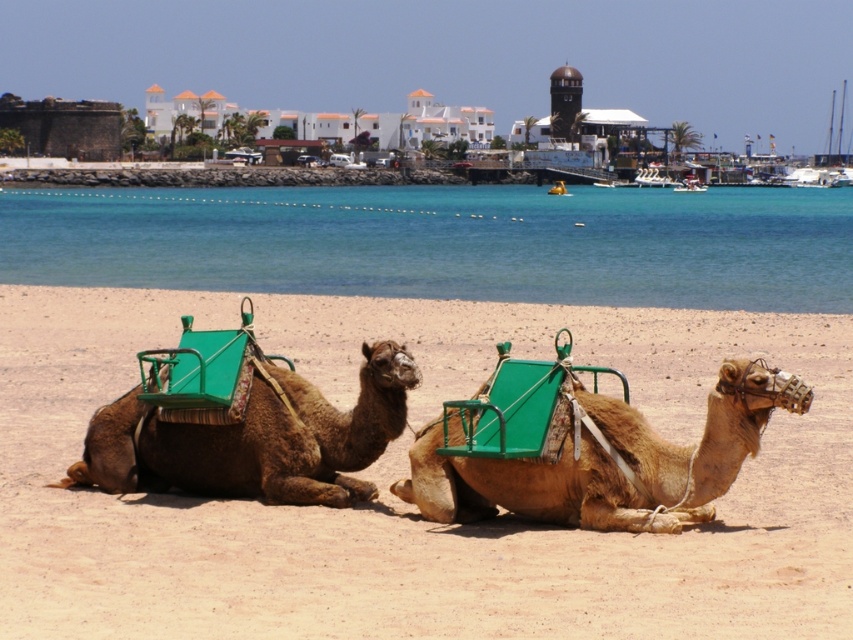
You are a photographer trying to capture the light brown leather camel at center in your shot. The camera you are using has a focal point at coordinates 0.722, 0.712. Will the camel be in focus?

Yes, the light brown leather camel at center is exactly at the focal point coordinates (606, 461), so it will be in focus.

You are a tourist standing at the point with coordinates point (606, 461). You want to take a photo of the light brown leather camel at center. Will you be able to see the light brown leather camel at center in your photo?

Yes, because the point (606, 461) corresponds to the light brown leather camel at center, so you are already at that location and can take a photo of it.